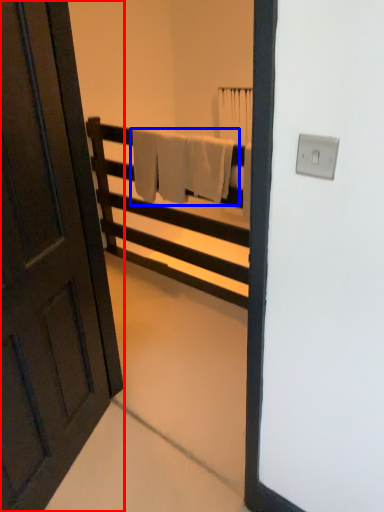
Question: Which object is further to the camera taking this photo, door (highlighted by a red box) or bath towel (highlighted by a blue box)?

Choices:
 (A) door
 (B) bath towel

Answer: (B)